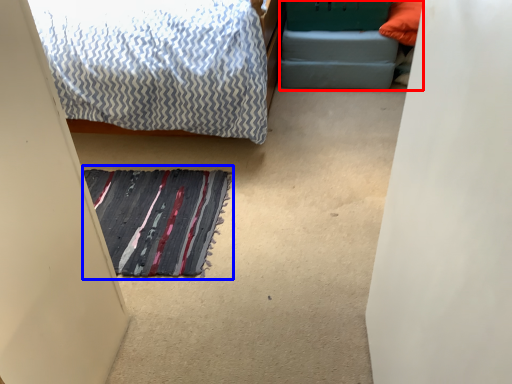
Question: Among these objects, which one is farthest to the camera, bed frame (highlighted by a red box) or doormat (highlighted by a blue box)?

Choices:
 (A) bed frame
 (B) doormat

Answer: (A)